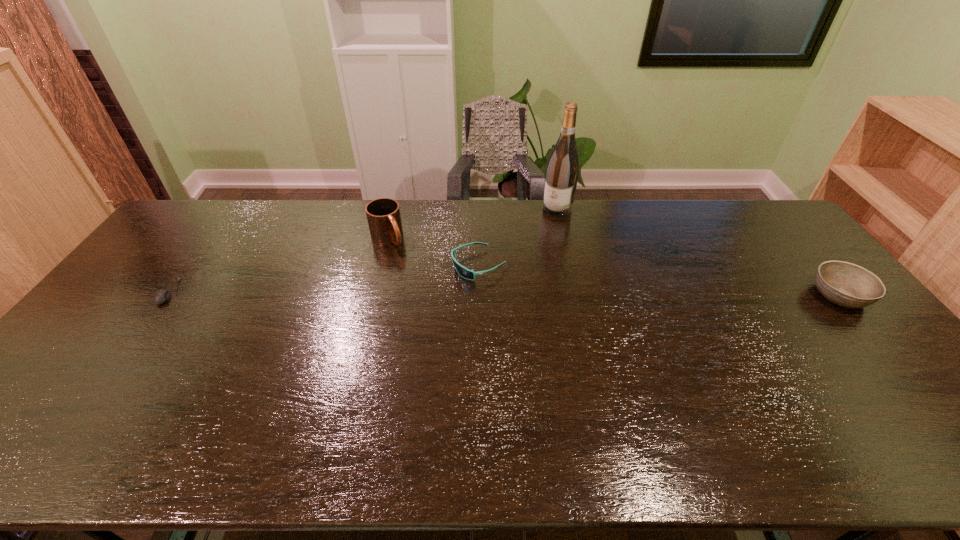
Identify the location of object that can be found as the second closest to the shortest object. This screenshot has height=540, width=960. (468, 274).

The height and width of the screenshot is (540, 960). What are the coordinates of `object identified as the closest to the third object from left to right` in the screenshot? It's located at (383, 214).

Identify the location of vacant space that satisfies the following two spatial constraints: 1. on the back side of the third object from right to left; 2. on the left side of the shortest object. Image resolution: width=960 pixels, height=540 pixels. [188, 265].

What are the coordinates of `vacant area in the image that satisfies the following two spatial constraints: 1. on the back side of the leftmost object; 2. on the left side of the third object from left to right` in the screenshot? It's located at (188, 265).